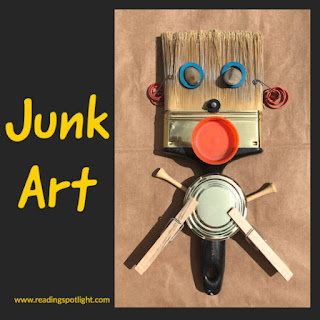
I want to click on handle, so click(212, 264).